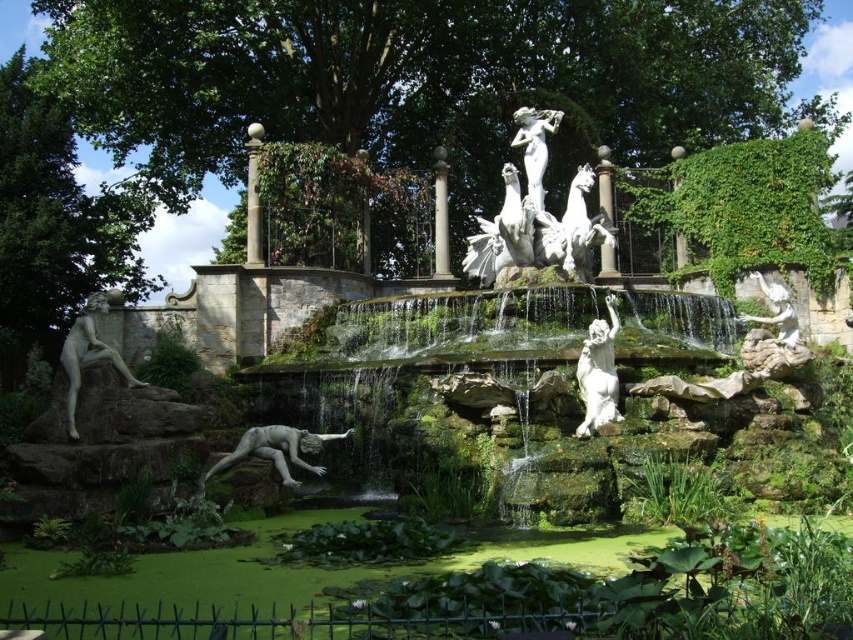
You are standing in the garden and want to take a photo of both the white stone fountain at center and the white marble sculpture at center. Since you can only focus on one object at a time, which one should you position closer to the camera to ensure it appears larger in the photo?

You should position the white stone fountain at center closer to the camera because it is already to the right of the white marble sculpture at center, so moving it closer would make it appear larger in the photo.

You are standing at the edge of the garden looking towards the fountain. There is a point marked at coordinates (x=537, y=212). What is located at this point?

The point at coordinates (x=537, y=212) marks the location of the white marble sculpture at center.